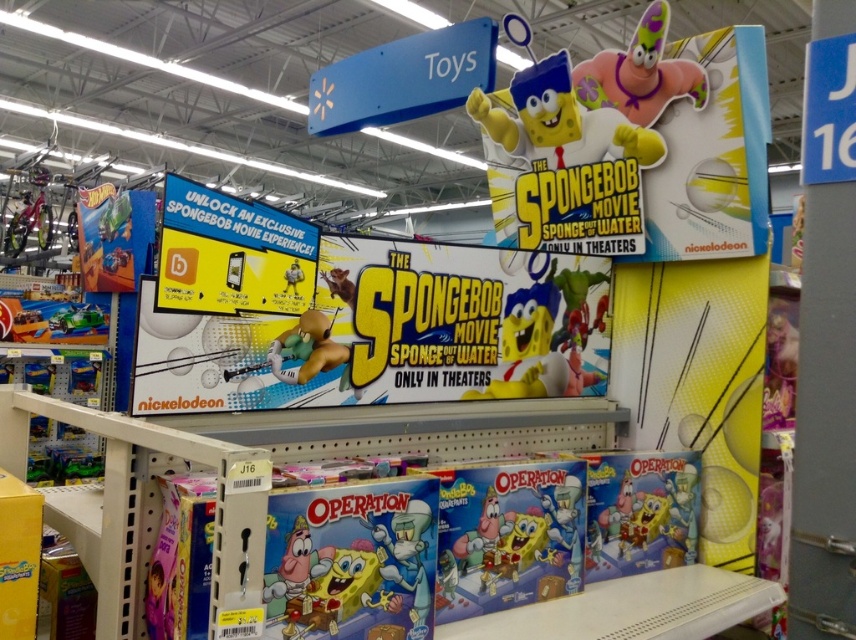
Question: Which point is closer to the camera?

Choices:
 (A) matte board game at center
 (B) matte green toy at lower left
 (C) matte yellow sponge at center
 (D) matte green plush at center

Answer: (C)

Question: Which object is the closest to the matte board game at center?

Choices:
 (A) matte green car at left
 (B) metallic silver bicycle at left
 (C) yellow matte sponge at center
 (D) matte green plush at center

Answer: (C)

Question: Is the position of matte board game at center more distant than that of metallic silver bicycle at left?

Choices:
 (A) no
 (B) yes

Answer: (A)

Question: Does matte board game at center appear on the right side of matte green plush at center?

Choices:
 (A) yes
 (B) no

Answer: (A)

Question: Which of these objects is positioned farthest from the purple rubber patrick at upper right?

Choices:
 (A) green plastic toy car at left
 (B) matte yellow sponge at center

Answer: (A)

Question: Is matte board game at center below metallic silver bicycle at left?

Choices:
 (A) yes
 (B) no

Answer: (A)